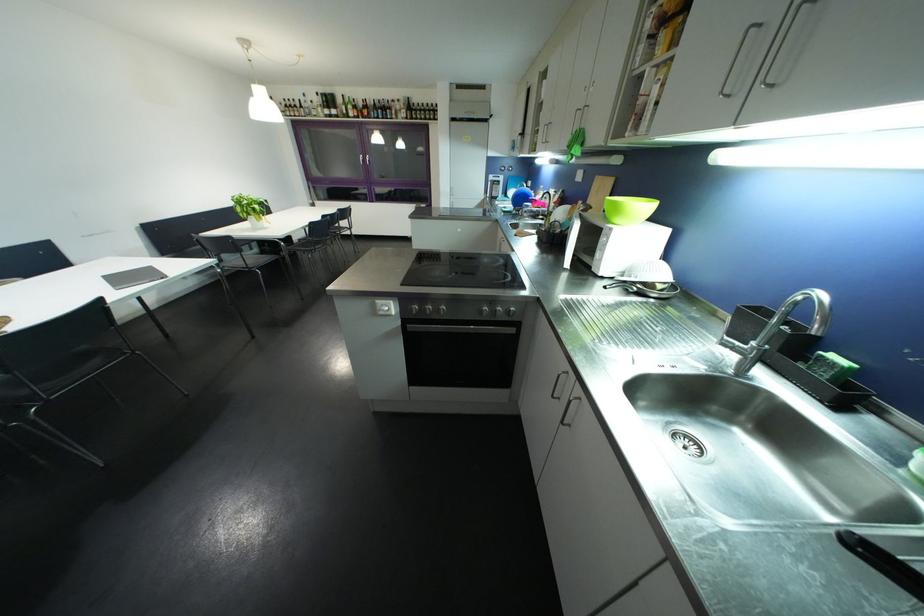
The height and width of the screenshot is (616, 924). Identify the location of black oven handle. coord(458,329).